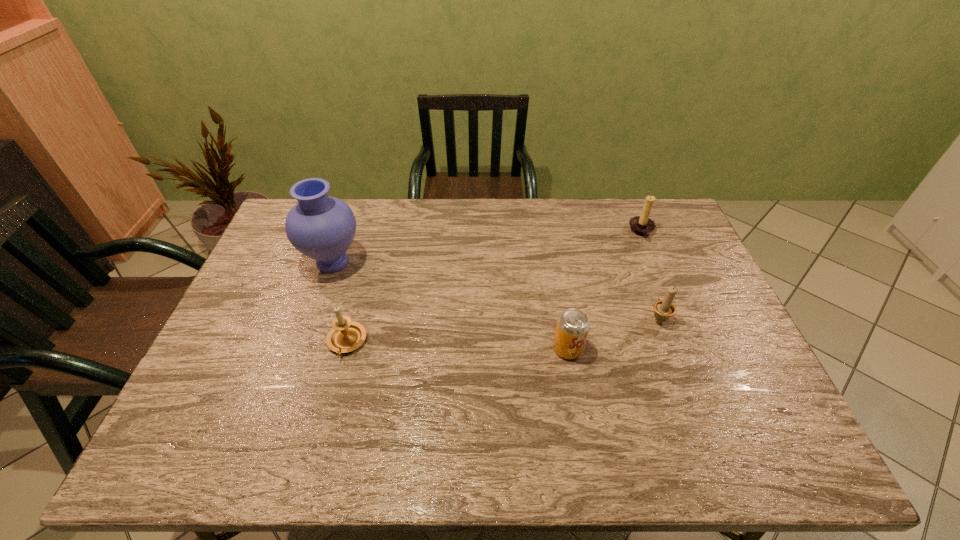
In order to click on empty space between the farthest candle holder and the third object from right to left in this screenshot , I will do [x=605, y=291].

Where is `vacant point located between the vase and the leftmost candle holder`? vacant point located between the vase and the leftmost candle holder is located at coordinates (340, 302).

The image size is (960, 540). Find the location of `unoccupied area between the farthest candle holder and the third object from left to right`. unoccupied area between the farthest candle holder and the third object from left to right is located at coordinates (605, 291).

The height and width of the screenshot is (540, 960). I want to click on free area in between the farthest candle holder and the third object from left to right, so click(x=605, y=291).

Find the location of a particular element. The height and width of the screenshot is (540, 960). unoccupied area between the farthest candle holder and the pop (soda) is located at coordinates (605, 291).

Find the location of a particular element. This screenshot has height=540, width=960. the second closest object to the pop (soda) is located at coordinates (642, 225).

Image resolution: width=960 pixels, height=540 pixels. I want to click on the third closest object to the leftmost candle holder, so click(x=664, y=309).

Find the location of a particular element. Image resolution: width=960 pixels, height=540 pixels. candle holder that is the nearest to the pop (soda) is located at coordinates (664, 309).

Locate which candle holder is the second closest to the third object from right to left. Please provide its 2D coordinates. Your answer should be formatted as a tuple, i.e. [(x, y)], where the tuple contains the x and y coordinates of a point satisfying the conditions above.

[(642, 225)]

The width and height of the screenshot is (960, 540). Identify the location of vacant area that satisfies the following two spatial constraints: 1. on the wick of the farthest candle holder; 2. with a handle on the side of the leftmost candle holder. 686,342.